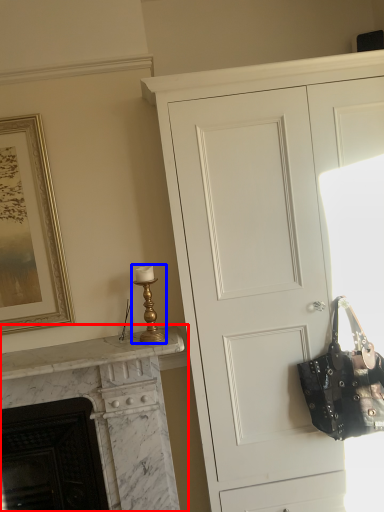
Question: Which point is further to the camera, fireplace (highlighted by a red box) or table lamp (highlighted by a blue box)?

Choices:
 (A) fireplace
 (B) table lamp

Answer: (B)